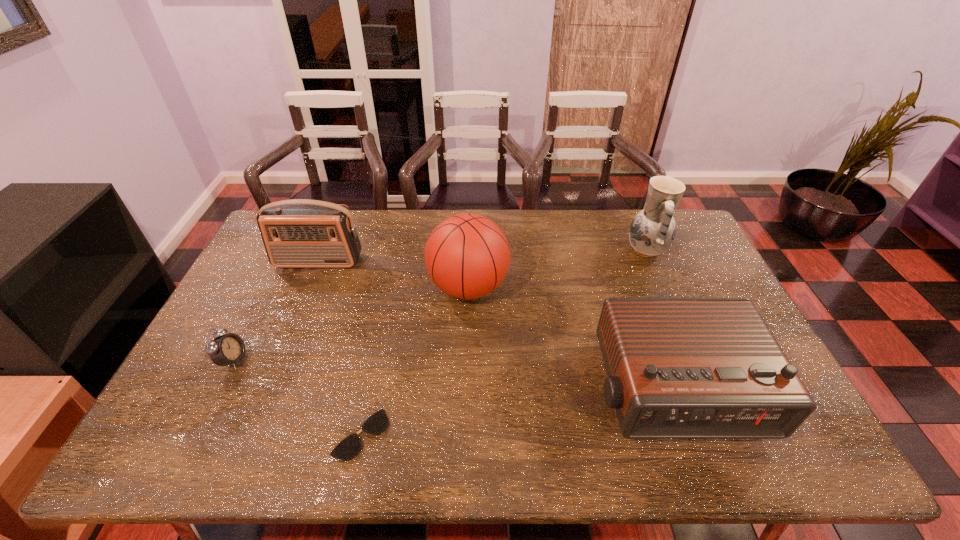
Identify the location of pottery. (652, 231).

Find the location of a particular element. The width and height of the screenshot is (960, 540). basketball is located at coordinates (467, 256).

The image size is (960, 540). I want to click on the farther radio receiver, so click(x=299, y=233).

Where is `the shorter radio receiver`? This screenshot has height=540, width=960. the shorter radio receiver is located at coordinates coord(677,367).

This screenshot has height=540, width=960. Find the location of `the nearer radio receiver`. the nearer radio receiver is located at coordinates (677, 367).

Find the location of a particular element. The image size is (960, 540). the fifth tallest object is located at coordinates (223, 350).

Locate an element on the screen. The image size is (960, 540). the shortest object is located at coordinates (350, 446).

I want to click on the third object from left to right, so click(x=350, y=446).

What are the coordinates of `free space located 0.340m on either side of the pottery` in the screenshot? It's located at (527, 251).

Identify the location of vacant space located on either side of the pottery. (608, 251).